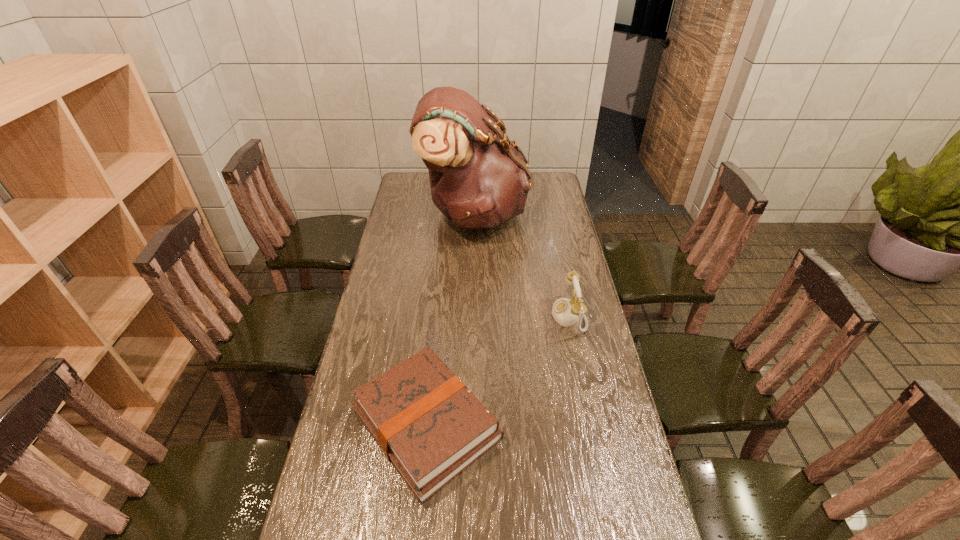
Where is `satchel`? The width and height of the screenshot is (960, 540). satchel is located at coordinates (479, 178).

Identify the location of the farthest object. The height and width of the screenshot is (540, 960). (479, 178).

This screenshot has height=540, width=960. What are the coordinates of `the second tallest object` in the screenshot? It's located at (565, 312).

This screenshot has width=960, height=540. In order to click on telephone in this screenshot , I will do `click(565, 312)`.

At what (x,y) coordinates should I click in order to perform the action: click on the shortest object. Please return your answer as a coordinate pair (x, y). This screenshot has height=540, width=960. Looking at the image, I should click on (428, 424).

I want to click on hardback book, so click(x=428, y=424).

This screenshot has width=960, height=540. Find the location of `vacant space located at the front of the farthest object with buckles`. vacant space located at the front of the farthest object with buckles is located at coordinates (556, 214).

Find the location of a particular element. free spot located on the dial of the rightmost object is located at coordinates (492, 316).

Locate an element on the screen. This screenshot has width=960, height=540. blank space located on the dial of the rightmost object is located at coordinates (444, 316).

The image size is (960, 540). In order to click on vacant position located on the dial of the rightmost object in this screenshot , I will do `click(518, 316)`.